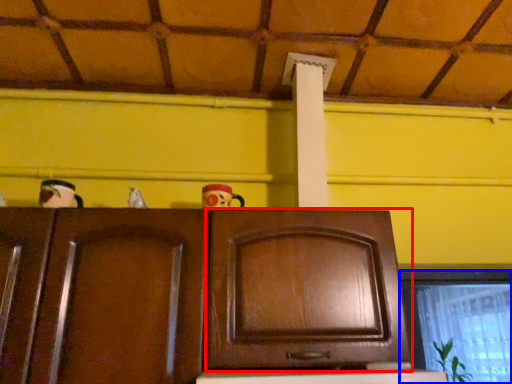
Question: Which of the following is the closest to the observer, cabinetry (highlighted by a red box) or window (highlighted by a blue box)?

Choices:
 (A) cabinetry
 (B) window

Answer: (A)